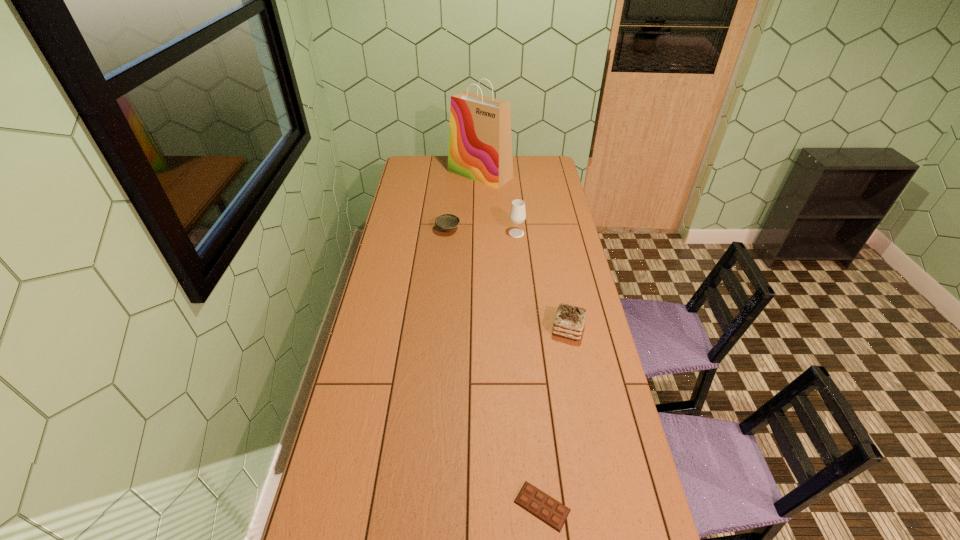
This screenshot has width=960, height=540. Identify the location of object that stands as the second closest to the glass. (480, 144).

The image size is (960, 540). Find the location of `vacant region that satisfies the following two spatial constraints: 1. on the front side of the bowl; 2. on the left side of the nearest object`. vacant region that satisfies the following two spatial constraints: 1. on the front side of the bowl; 2. on the left side of the nearest object is located at coordinates (422, 506).

Identify the location of vacant space that satisfies the following two spatial constraints: 1. on the front side of the shortest object; 2. on the right side of the bowl. (422, 506).